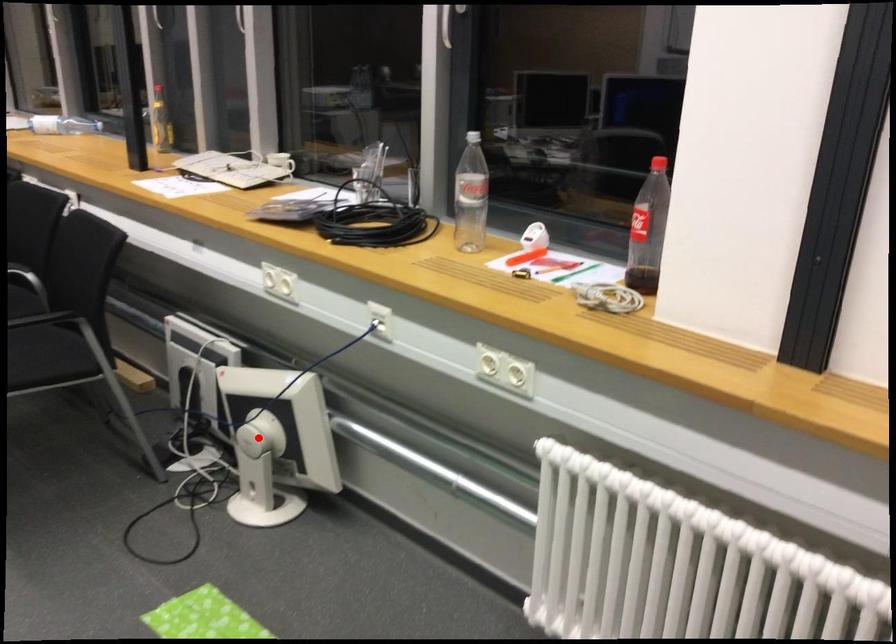
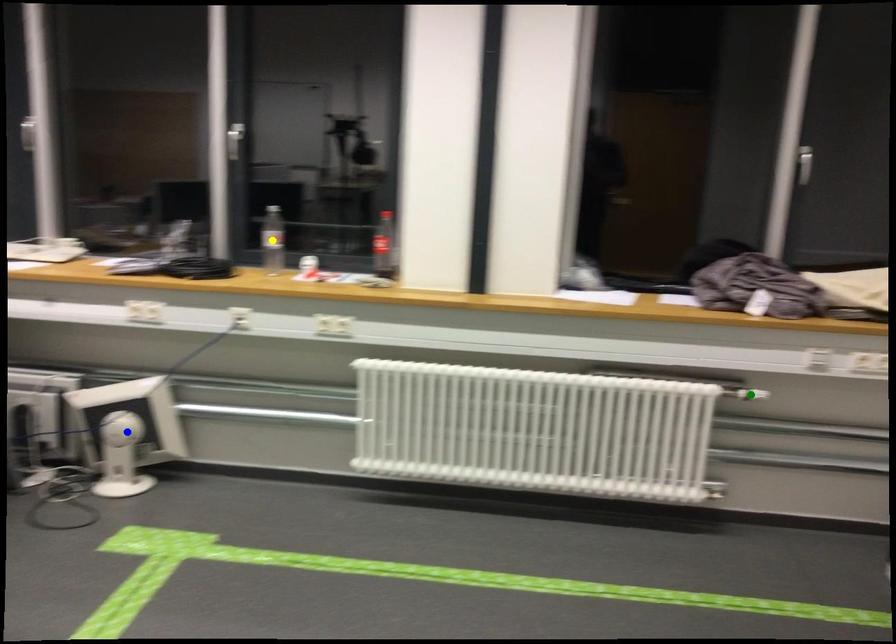
Question: I am providing you with two images of the same scene from different viewpoints. A red point is marked on the first image. You are given multiple points on the second image. Which spot in image 2 lines up with the point in image 1?

Choices:
 (A) green point
 (B) yellow point
 (C) blue point

Answer: (C)